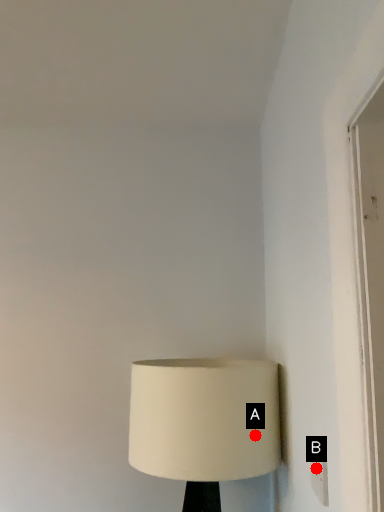
Question: Two points are circled on the image, labeled by A and B beside each circle. Which point appears farthest from the camera in this image?

Choices:
 (A) A is further
 (B) B is further

Answer: (A)